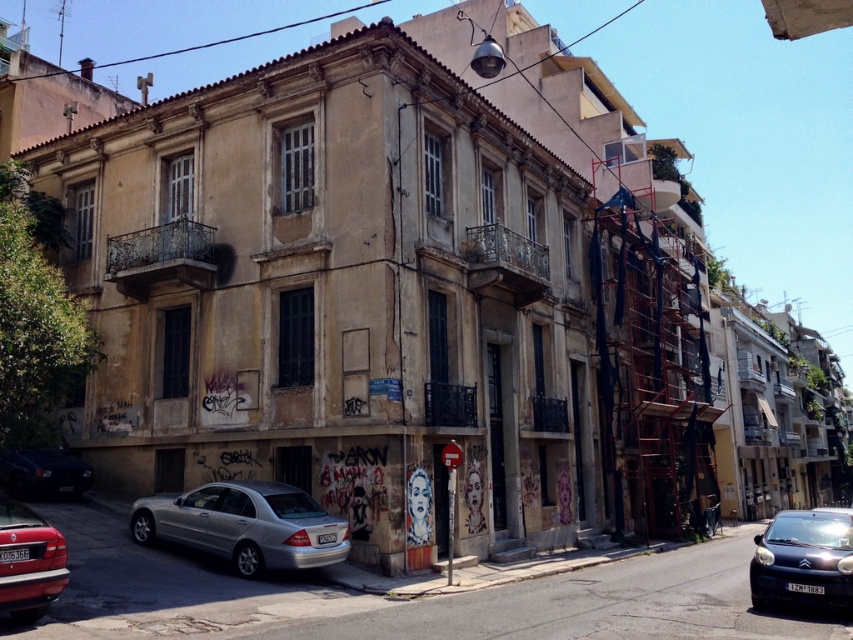
You are a delivery driver who needs to park your van in the street scene shown. The van requires a parking spot that is at least 2 meters wide. Based on the scene, can you determine if there is enough space between the shiny black car at lower right and the building wall to park your van?

The position of shiny black car at lower right is at point (804, 560). Since the exact distance between the car and the building wall isn t provided in the scene description, it s impossible to determine if there s sufficient space for the van. More information about the dimensions or spacing would be needed to answer this accurately.

You are a pedestrian standing on the sidewalk in front of the building. You want to walk to the entrance of the building, which is directly ahead of you. Which car, the silver metallic car at lower center or the shiny red sedan at lower left, is closer to the building?

The silver metallic car at lower center is closer to the building because it is positioned below the shiny red sedan at lower left, meaning it is further down the sidewalk towards the building.

In the scene shown: You are a delivery person needing to park your van, which is 5 meters long, near the shiny black car at lower right and dark blue matte car at lower left. Can your van fit between these two cars without overlapping them?

The shiny black car at lower right is larger than the dark blue matte car at lower left. However, the exact distance between them isn generated from the provided information. Therefore, it is uncertain if the van can fit between them.